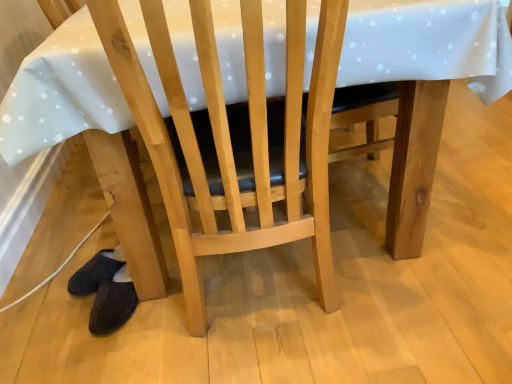
Find the location of a particular element. The height and width of the screenshot is (384, 512). vacant space in front of dark blue fuzzy slippers at lower left is located at coordinates (113, 353).